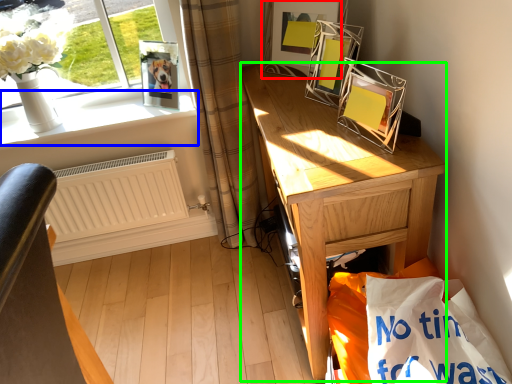
Question: Which is nearer to the picture frame (highlighted by a red box)? window sill (highlighted by a blue box) or desk (highlighted by a green box).

Choices:
 (A) window sill
 (B) desk

Answer: (B)